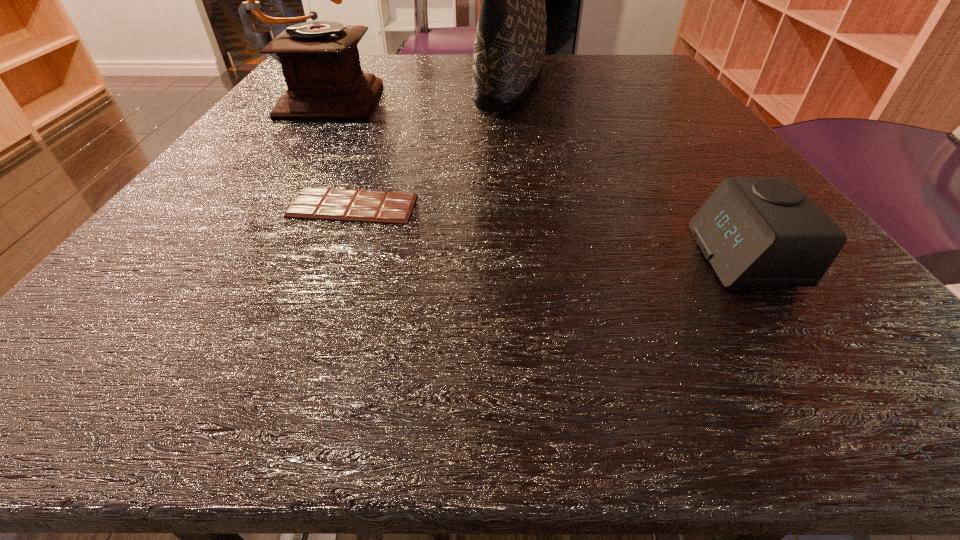
What are the coordinates of `empty space that is in between the third object from left to right and the second tallest object` in the screenshot? It's located at (419, 90).

Locate an element on the screen. The image size is (960, 540). unoccupied position between the alarm clock and the third shortest object is located at coordinates (535, 176).

This screenshot has height=540, width=960. I want to click on unoccupied area between the second tallest object and the tote bag, so 419,90.

At what (x,y) coordinates should I click in order to perform the action: click on vacant point located between the second nearest object and the alarm clock. Please return your answer as a coordinate pair (x, y). The width and height of the screenshot is (960, 540). Looking at the image, I should click on (548, 231).

This screenshot has width=960, height=540. Find the location of `unoccupied position between the tallest object and the second nearest object`. unoccupied position between the tallest object and the second nearest object is located at coordinates (432, 145).

Where is `free area in between the third object from left to right and the shortest object`? The width and height of the screenshot is (960, 540). free area in between the third object from left to right and the shortest object is located at coordinates (432, 145).

Find the location of a particular element. Image resolution: width=960 pixels, height=540 pixels. free space between the third shortest object and the alarm clock is located at coordinates (535, 176).

Where is `the second closest object relative to the shortest object`? the second closest object relative to the shortest object is located at coordinates (510, 41).

You are a GUI agent. You are given a task and a screenshot of the screen. Output one action in this format:
    pyautogui.click(x=<x>, y=<y>)
    Task: Click on the object that can be found as the closest to the third shortest object
    This screenshot has width=960, height=540.
    Given the screenshot: What is the action you would take?
    pyautogui.click(x=510, y=41)

In order to click on vacant space that satisfies the following two spatial constraints: 1. on the horn of the third shortest object; 2. on the back side of the shortest object in this screenshot , I will do `click(252, 206)`.